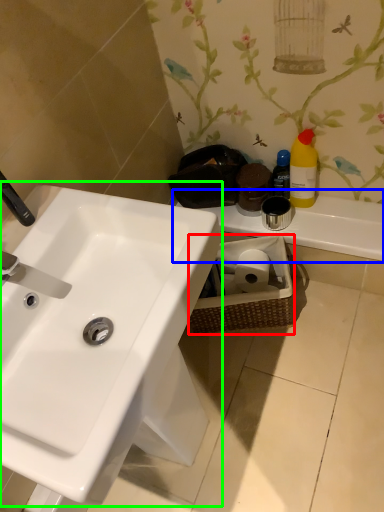
Question: Estimate the real-world distances between objects in this image. Which object is farther from basket (highlighted by a red box), counter top (highlighted by a blue box) or sink (highlighted by a green box)?

Choices:
 (A) counter top
 (B) sink

Answer: (B)